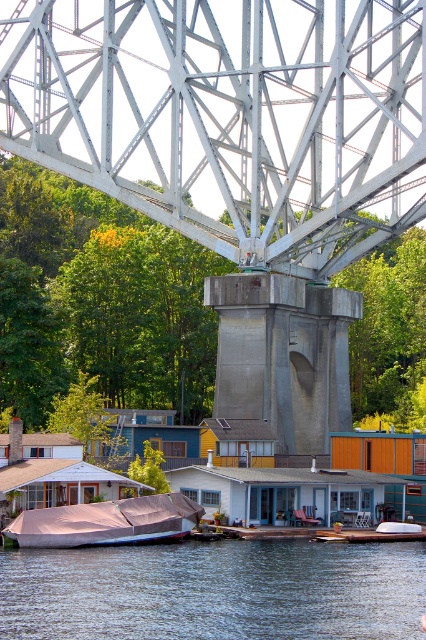
Question: Which of these objects is positioned farthest from the metallic gray bridge at center?

Choices:
 (A) matte pink tarp at lower left
 (B) blue water at lower center

Answer: (B)

Question: Which object appears closest to the camera in this image?

Choices:
 (A) blue water at lower center
 (B) matte pink tarp at lower left
 (C) metallic gray bridge at center

Answer: (A)

Question: Does blue water at lower center lie in front of matte pink tarp at lower left?

Choices:
 (A) no
 (B) yes

Answer: (B)

Question: Where is metallic gray bridge at center located in relation to matte pink tarp at lower left in the image?

Choices:
 (A) above
 (B) below

Answer: (A)

Question: Does metallic gray bridge at center lie behind blue water at lower center?

Choices:
 (A) yes
 (B) no

Answer: (A)

Question: Which point appears closest to the camera in this image?

Choices:
 (A) (175, 513)
 (B) (276, 621)

Answer: (B)